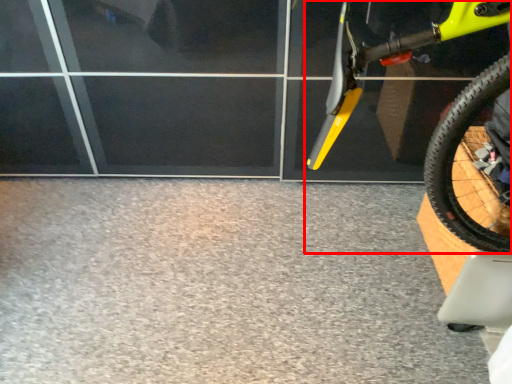
Question: From the image's perspective, where is bicycle (annotated by the red box) located in relation to concrete in the image?

Choices:
 (A) above
 (B) below

Answer: (A)